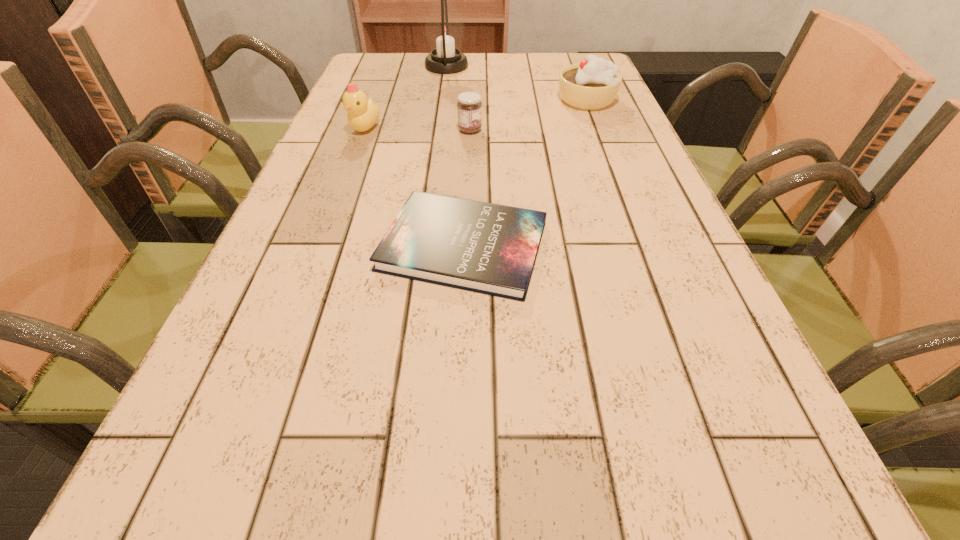
You are a GUI agent. You are given a task and a screenshot of the screen. Output one action in this format:
    pyautogui.click(x=<x>, y=<y>)
    Task: Click on the oil lamp
    The height and width of the screenshot is (540, 960).
    Given the screenshot: What is the action you would take?
    coord(444,28)

Image resolution: width=960 pixels, height=540 pixels. Find the location of `the tallest object`. the tallest object is located at coordinates (444, 28).

Locate an element on the screen. whipped cream is located at coordinates (593, 84).

At what (x,y) coordinates should I click in order to perform the action: click on the rightmost object. Please return your answer as a coordinate pair (x, y). Looking at the image, I should click on (593, 84).

Find the location of a particular element. The height and width of the screenshot is (540, 960). the leftmost object is located at coordinates (362, 115).

Image resolution: width=960 pixels, height=540 pixels. What are the coordinates of `jam` in the screenshot? It's located at click(469, 106).

You are a GUI agent. You are given a task and a screenshot of the screen. Output one action in this format:
    pyautogui.click(x=<x>, y=<y>)
    Task: Click on the shortest object
    Image resolution: width=960 pixels, height=540 pixels.
    Given the screenshot: What is the action you would take?
    pyautogui.click(x=488, y=248)

You are a GUI agent. You are given a task and a screenshot of the screen. Output one action in this format:
    pyautogui.click(x=<x>, y=<y>)
    Task: Click on the nearest object
    
    Given the screenshot: What is the action you would take?
    pyautogui.click(x=488, y=248)

This screenshot has height=540, width=960. I want to click on free space located 0.290m on the front of the oil lamp, so click(x=439, y=124).

The height and width of the screenshot is (540, 960). I want to click on vacant space located on the left of the rightmost object, so click(x=444, y=100).